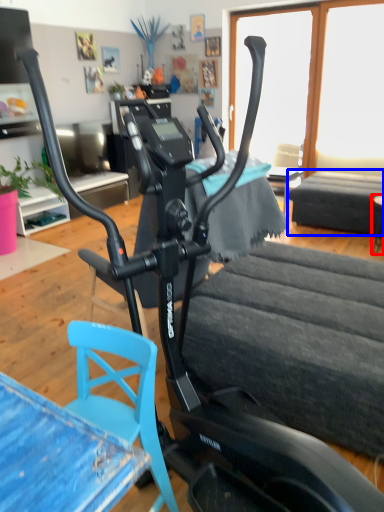
Question: Which point is further to the camera, table (highlighted by a red box) or table (highlighted by a blue box)?

Choices:
 (A) table
 (B) table

Answer: (B)